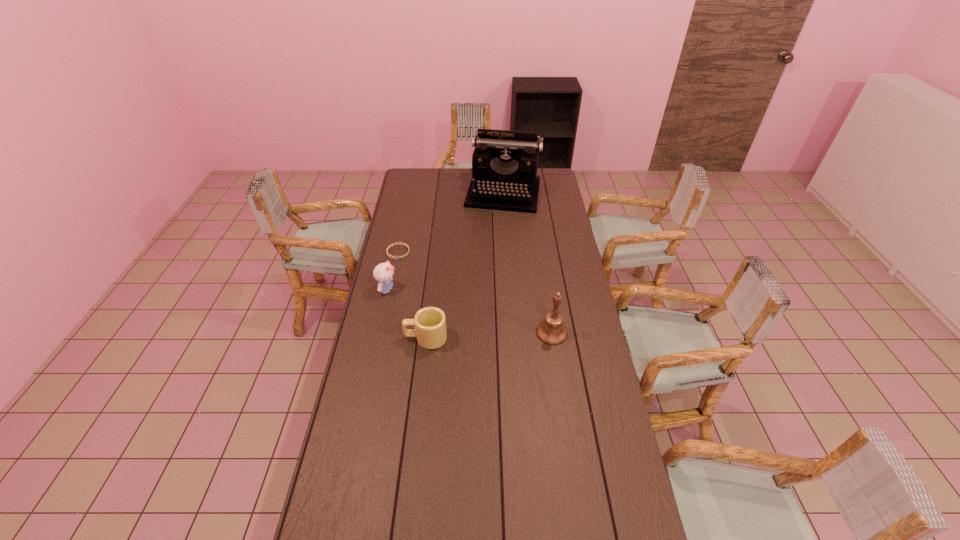
I want to click on vacant region at the left edge, so click(407, 215).

I want to click on vacant point at the right edge, so click(590, 421).

The height and width of the screenshot is (540, 960). I want to click on free space at the far right corner of the desktop, so (x=553, y=183).

The height and width of the screenshot is (540, 960). Find the location of `vacant region between the bell and the typewriter`. vacant region between the bell and the typewriter is located at coordinates (528, 263).

This screenshot has height=540, width=960. I want to click on free area in between the kitten and the mug, so click(x=407, y=314).

The image size is (960, 540). What are the coordinates of `vacant area that lies between the bell and the shortest object` in the screenshot? It's located at (475, 292).

I want to click on vacant region between the mug and the shortest object, so click(412, 295).

Where is `free space between the shortest object and the mug`? free space between the shortest object and the mug is located at coordinates (412, 295).

This screenshot has width=960, height=540. What are the coordinates of `empty space between the tallest object and the third tallest object` in the screenshot? It's located at (445, 242).

Image resolution: width=960 pixels, height=540 pixels. Identify the location of empty space between the third nearest object and the fourth shortest object. (469, 312).